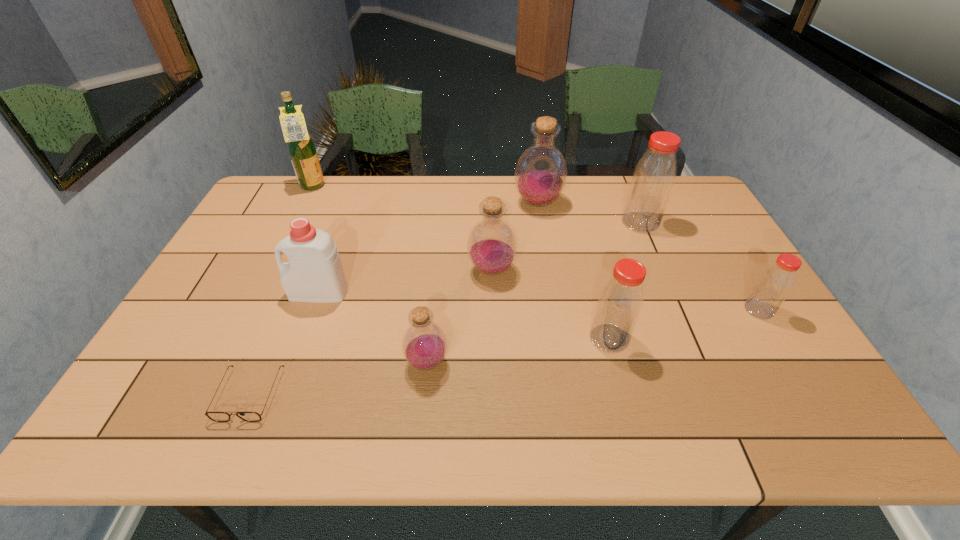
Locate an element on the screen. The width and height of the screenshot is (960, 540). vacant space at the far edge of the desktop is located at coordinates (612, 188).

This screenshot has height=540, width=960. What are the coordinates of `vacant space at the left edge` in the screenshot? It's located at (252, 271).

You are a GUI agent. You are given a task and a screenshot of the screen. Output one action in this format:
    pyautogui.click(x=<x>, y=<y>)
    Task: Click on the free space at the right edge
    
    Given the screenshot: What is the action you would take?
    click(783, 329)

In order to click on vacant space at the far left corner in this screenshot , I will do `click(291, 178)`.

The width and height of the screenshot is (960, 540). What are the coordinates of `blank region between the biggest purple bottle and the liquor` in the screenshot? It's located at (425, 195).

Locate an element on the screen. free space between the biggest purple bottle and the rightmost bottle is located at coordinates (648, 256).

At what (x,y) coordinates should I click in order to perform the action: click on unoccupied area between the farthest red bottle and the farthest purple bottle. Please return your answer as a coordinate pair (x, y). The width and height of the screenshot is (960, 540). Looking at the image, I should click on (589, 213).

At what (x,y) coordinates should I click in order to perform the action: click on empty space that is in between the rightmost purple bottle and the farthest red bottle. Please return your answer as a coordinate pair (x, y). The height and width of the screenshot is (540, 960). Looking at the image, I should click on (589, 213).

The height and width of the screenshot is (540, 960). Identify the location of free point between the second red bottle from left to right and the sixth object from right to left. (534, 292).

Find the location of a particular element. The height and width of the screenshot is (540, 960). vacant space that's between the second purple bottle from left to right and the liquor is located at coordinates (402, 228).